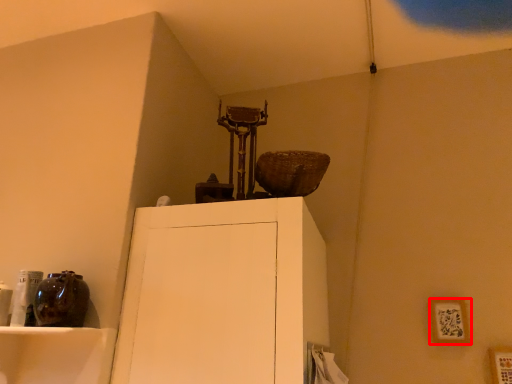
Question: Where is picture frame (annotated by the red box) located in relation to picture frame in the image?

Choices:
 (A) left
 (B) right

Answer: (A)